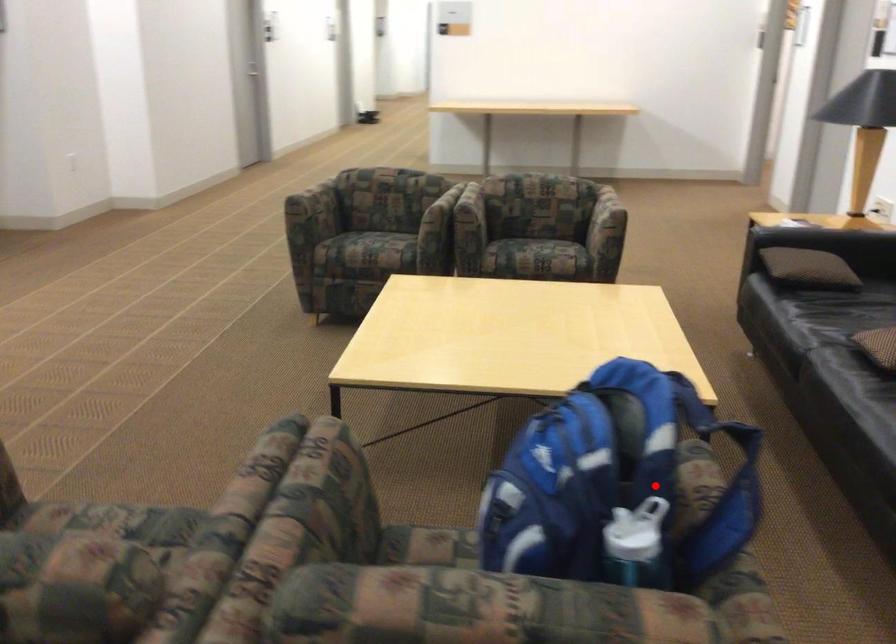
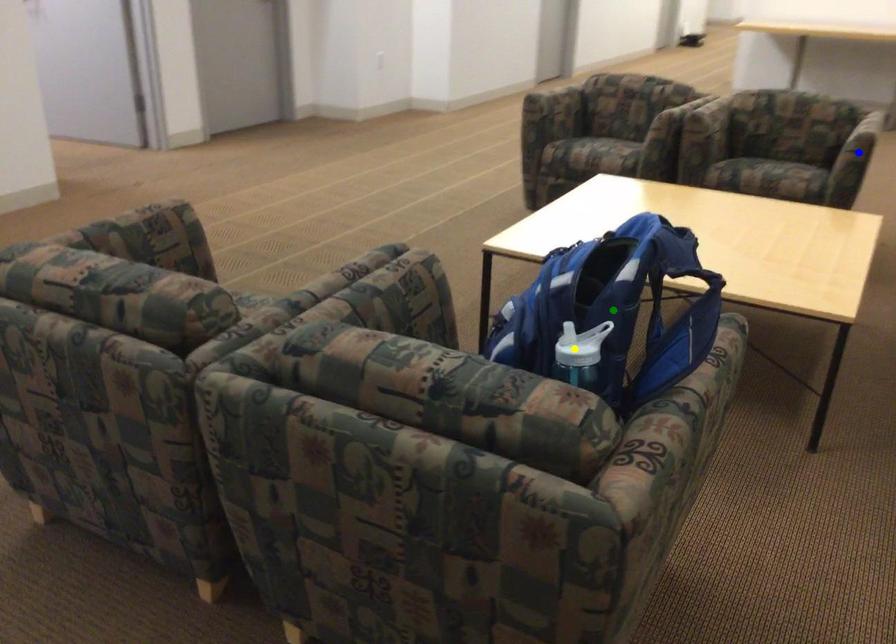
Question: I am providing you with two images of the same scene from different viewpoints. A red point is marked on the first image. You are given multiple points on the second image. Can you choose the point in image 2 that corresponds to the point in image 1?

Choices:
 (A) green point
 (B) yellow point
 (C) blue point

Answer: (A)